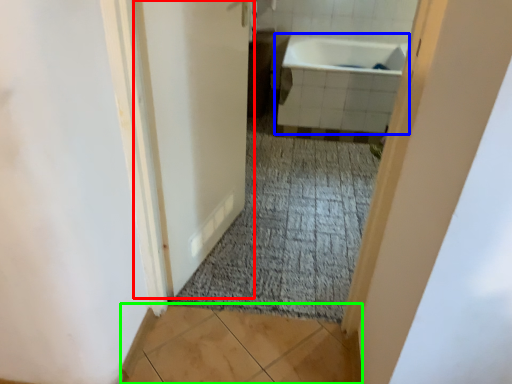
Question: Which object is the farthest from door (highlighted by a red box)? Choose among these: bathtub (highlighted by a blue box) or tile (highlighted by a green box).

Choices:
 (A) bathtub
 (B) tile

Answer: (A)